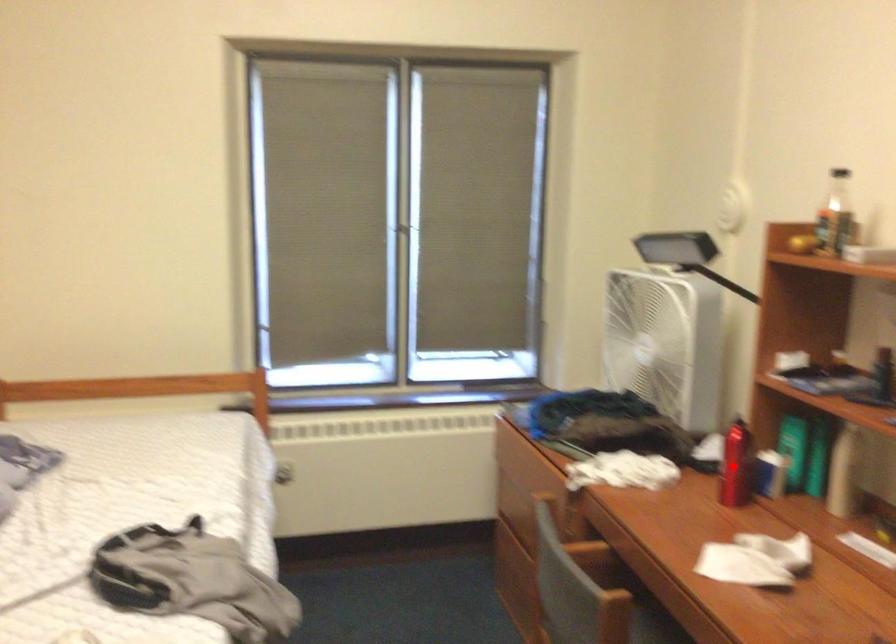
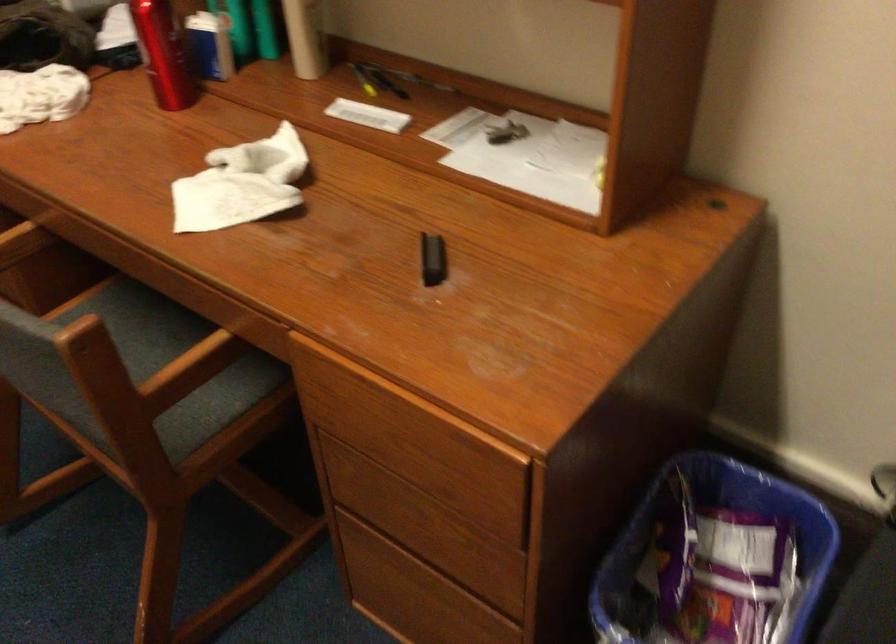
Question: I am providing you with two images of the same scene from different viewpoints. A red point is marked on the first image. Is the red point's position out of view in image 2?

Choices:
 (A) Yes
 (B) No

Answer: (B)